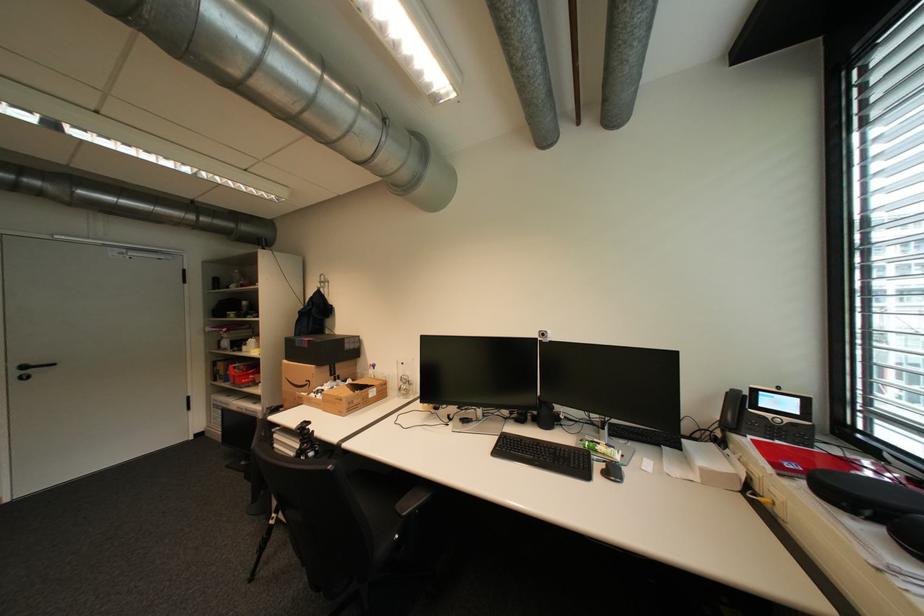
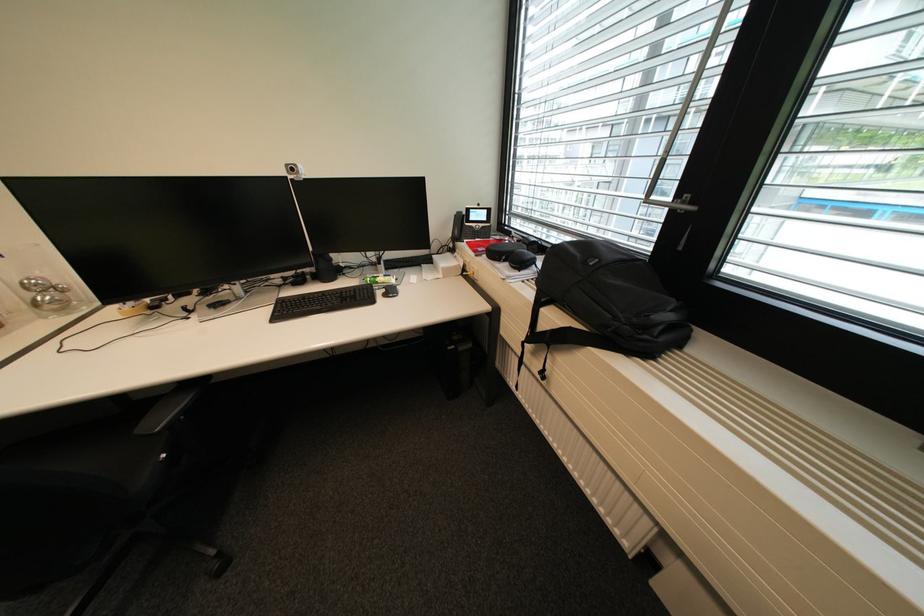
How did the camera likely rotate?

The camera's rotation is toward right-down.